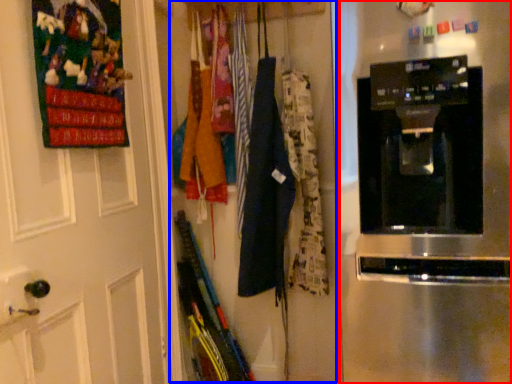
Question: Which object is further to the camera taking this photo, home appliance (highlighted by a red box) or closet (highlighted by a blue box)?

Choices:
 (A) home appliance
 (B) closet

Answer: (B)